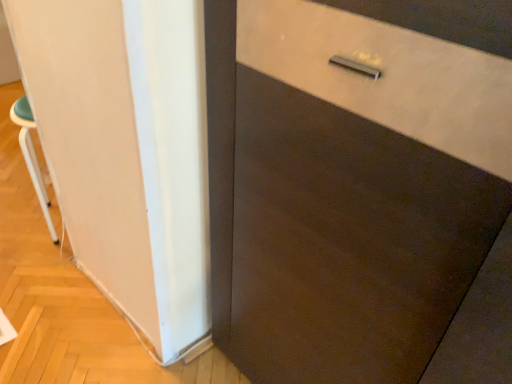
You are a GUI agent. You are given a task and a screenshot of the screen. Output one action in this format:
    pyautogui.click(x=<x>, y=<y>)
    Task: Click on the free space to the back side of white matte barn door at left
    
    Given the screenshot: What is the action you would take?
    pyautogui.click(x=110, y=353)